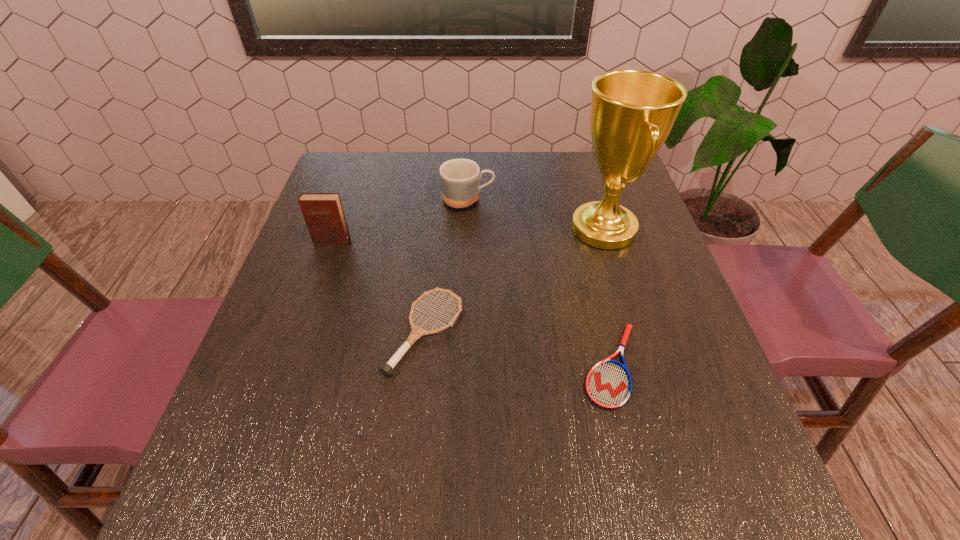
Locate an element on the screen. The image size is (960, 540). award is located at coordinates (633, 111).

I want to click on the leftmost object, so click(323, 213).

Image resolution: width=960 pixels, height=540 pixels. Find the location of `diary`. diary is located at coordinates (323, 213).

Locate an element on the screen. The width and height of the screenshot is (960, 540). mug is located at coordinates (459, 178).

Locate an element on the screen. The width and height of the screenshot is (960, 540). the taller tennis racket is located at coordinates (386, 369).

The width and height of the screenshot is (960, 540). Identify the location of the left tennis racket. (386, 369).

This screenshot has width=960, height=540. Identify the location of the shortest object. (608, 385).

The image size is (960, 540). Identify the location of the right tennis racket. (608, 385).

The image size is (960, 540). In order to click on free space located by the handles of the tallest object in this screenshot , I will do `click(441, 229)`.

Image resolution: width=960 pixels, height=540 pixels. Identify the location of free space located 0.160m by the handles of the tallest object. (x=504, y=229).